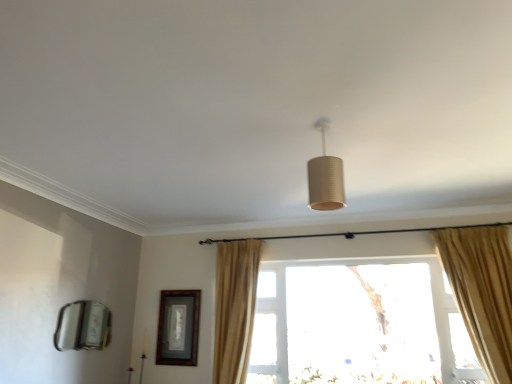
Question: Is beige fabric curtain at center facing away from wooden framed picture at center left?

Choices:
 (A) no
 (B) yes

Answer: (A)

Question: Considering the relative positions of beige fabric curtain at center and wooden framed picture at center left in the image provided, is beige fabric curtain at center to the left of wooden framed picture at center left from the viewer's perspective?

Choices:
 (A) yes
 (B) no

Answer: (B)

Question: Is beige fabric curtain at center not near wooden framed picture at center left?

Choices:
 (A) no
 (B) yes

Answer: (A)

Question: From a real-world perspective, is beige fabric curtain at center physically below wooden framed picture at center left?

Choices:
 (A) no
 (B) yes

Answer: (A)

Question: Is beige fabric curtain at center not inside wooden framed picture at center left?

Choices:
 (A) no
 (B) yes

Answer: (B)

Question: Is wooden framed picture at center left surrounded by beige fabric curtain at center?

Choices:
 (A) no
 (B) yes

Answer: (A)

Question: Is transparent glass window at center facing away from matte cardboard lampshade at center?

Choices:
 (A) yes
 (B) no

Answer: (B)

Question: Would you say transparent glass window at center is a long distance from matte cardboard lampshade at center?

Choices:
 (A) yes
 (B) no

Answer: (A)

Question: From the image's perspective, would you say transparent glass window at center is shown under matte cardboard lampshade at center?

Choices:
 (A) yes
 (B) no

Answer: (A)

Question: Is transparent glass window at center surrounding matte cardboard lampshade at center?

Choices:
 (A) yes
 (B) no

Answer: (B)

Question: Is transparent glass window at center closer to the viewer compared to matte cardboard lampshade at center?

Choices:
 (A) yes
 (B) no

Answer: (B)

Question: Considering the relative sizes of transparent glass window at center and matte cardboard lampshade at center in the image provided, is transparent glass window at center bigger than matte cardboard lampshade at center?

Choices:
 (A) no
 (B) yes

Answer: (B)

Question: Can you confirm if matte cardboard lampshade at center is positioned to the right of wooden framed picture at center left?

Choices:
 (A) yes
 (B) no

Answer: (A)